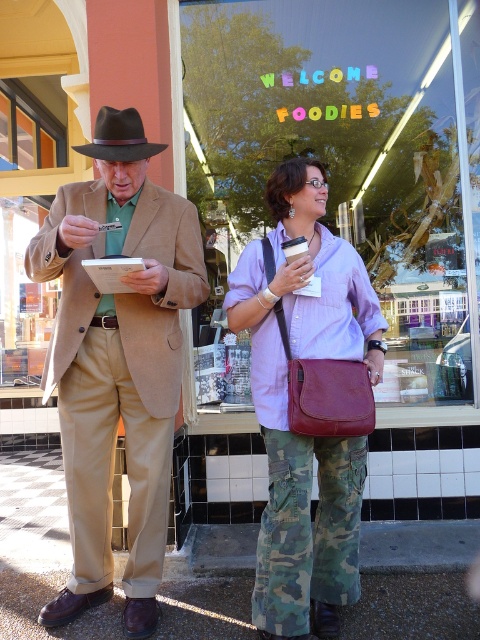
You are a photographer positioned behind the two people at the scene. You want to take a photo where both the matte brown suit at center and the matte purple shirt at center are clearly visible. Given their heights, which person should you position closer to the camera to ensure both are fully visible in the frame?

The matte brown suit at center is taller than the matte purple shirt at center. To ensure both are fully visible, position the taller matte brown suit at center closer to the camera so its height doesn

You are a window cleaner who needs to clean the matte glass window at center and the matte brown suit at center. Which object requires a larger cleaning area?

The matte glass window at center requires a larger cleaning area since it is larger in size than the matte brown suit at center according to the description.

You are a photographer standing at a certain distance from the matte brown suit at center. You want to take a closeup photo of it without moving closer. Your camera has a zoom range of 5 feet. Can you capture a clear closeup?

The matte brown suit at center is 6.85 feet away from the camera, which exceeds the camera zoom range of 5 feet. Therefore, you cannot capture a clear closeup without moving closer.